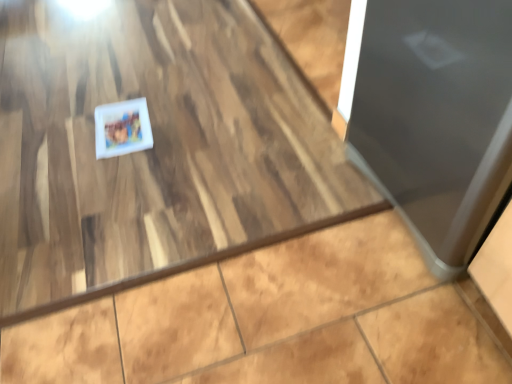
This screenshot has height=384, width=512. I want to click on vacant space that's between glossy metallic door at right and white matte postcard at center, so click(x=248, y=166).